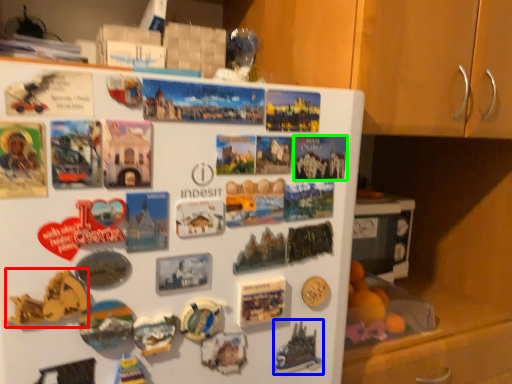
Question: Which object is positioned farthest from art (highlighted by a red box)? Select from art (highlighted by a blue box) and postcard (highlighted by a green box).

Choices:
 (A) art
 (B) postcard

Answer: (B)